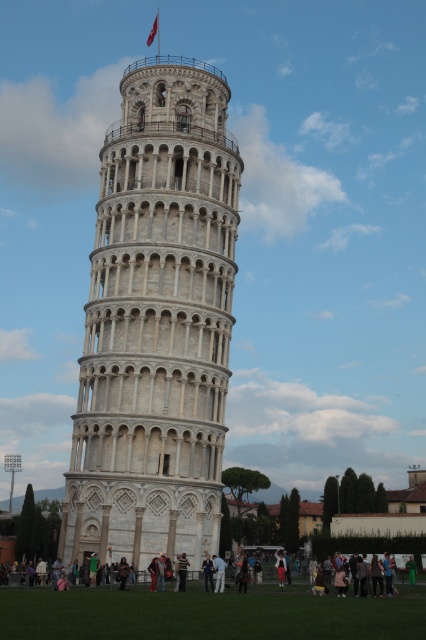
You are standing at a certain distance from the white stone tower at center and want to take a photo. The minimum safe distance for visitors to the tower is 45 meters. Is your current position within the safe zone?

The white stone tower at center and camera are 46.36 meters apart from each other, so your current position is outside the safe zone since it exceeds the 45 meters minimum requirement.

You are a tourist visiting the Leaning Tower of Pisa and notice both the white stone tower at center and the striped sweater at center in the scene. From your vantage point, which object is closer to you?

The white stone tower at center is closer to you because the striped sweater at center is behind it.

You are a tourist visiting the Leaning Tower of Pisa and want to take a photo with the white stone tower at center. There is a light brown wooden bench at lower center nearby. Can you stand on the bench to get a better angle for your photo?

The white stone tower at center is bigger than the light brown wooden bench at lower center, so standing on the bench might provide a better vantage point to capture the tower in your photo.